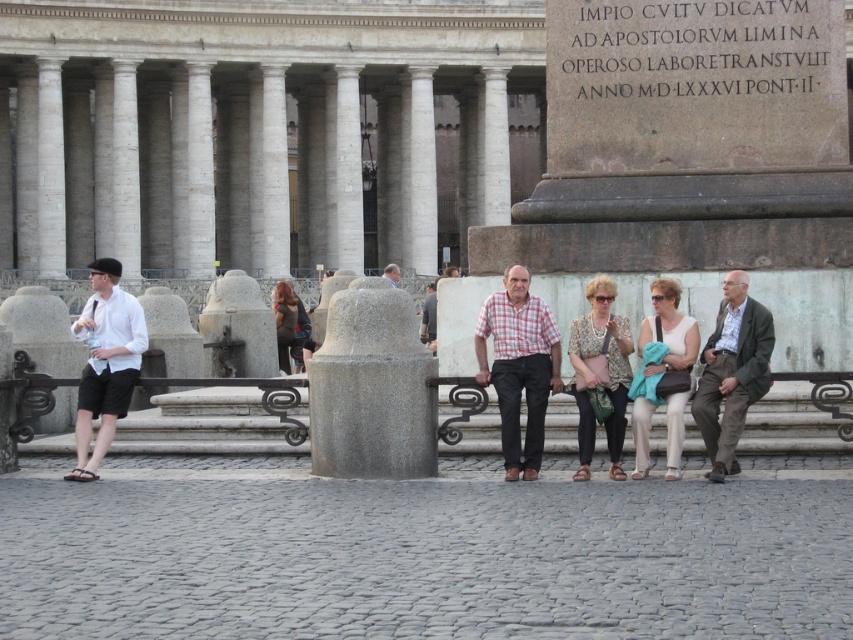
Is matte brown coat at center behind smooth gray stone statue at center?

No, matte brown coat at center is closer to the viewer.

Who is more forward, (285, 296) or (386, 275)?

Point (285, 296)

Find the location of a particular element. matte brown coat at center is located at coordinates (287, 323).

Can you confirm if white cotton dress at center is thinner than matte brown coat at center?

Indeed, white cotton dress at center has a lesser width compared to matte brown coat at center.

Which of these two, white cotton dress at center or matte brown coat at center, stands shorter?

white cotton dress at center

Who is more distant from viewer, (647, 364) or (300, 317)?

The point (300, 317) is behind.

Where is `white cotton dress at center`? white cotton dress at center is located at coordinates (669, 328).

From the picture: Between white cotton shirt at left and floral print blouse at center, which one appears on the right side from the viewer's perspective?

floral print blouse at center is more to the right.

Is white cotton shirt at left smaller than floral print blouse at center?

Incorrect, white cotton shirt at left is not smaller in size than floral print blouse at center.

Which is behind, point (91, 356) or point (583, 342)?

The point (91, 356) is behind.

Locate an element on the screen. The image size is (853, 640). white cotton shirt at left is located at coordinates (106, 362).